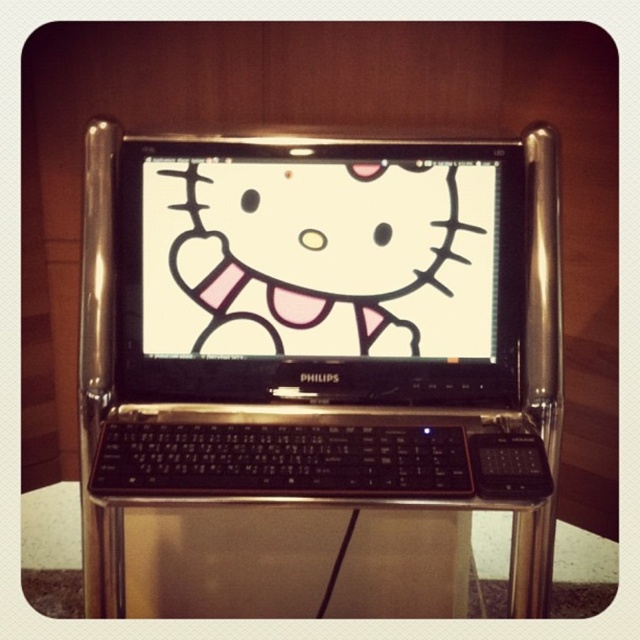
Does point (429, 275) come closer to viewer compared to point (326, 209)?

No, it is behind (326, 209).

Is point (472, 269) more distant than point (276, 227)?

No, (472, 269) is in front of (276, 227).

Image resolution: width=640 pixels, height=640 pixels. What are the coordinates of `white matte hello kitty at center` in the screenshot? It's located at (317, 259).

The width and height of the screenshot is (640, 640). Identify the location of white matte hello kitty at center. (317, 259).

Between black plastic laptop at center and matte white face at center, which one appears on the right side from the viewer's perspective?

From the viewer's perspective, black plastic laptop at center appears more on the right side.

Between black plastic laptop at center and matte white face at center, which one has less height?

Standing shorter between the two is matte white face at center.

Which is behind, point (198, 484) or point (280, 244)?

The point (280, 244) is more distant.

Find the location of a particular element. This screenshot has height=640, width=640. black plastic laptop at center is located at coordinates (321, 320).

Is point (420, 252) less distant than point (362, 294)?

Yes, it is in front of point (362, 294).

Is black plastic laptop at center smaller than white matte hello kitty at center?

No, black plastic laptop at center is not smaller than white matte hello kitty at center.

Looking at this image, who is more forward, [157,436] or [284,209]?

Point [157,436] is more forward.

At what (x,y) coordinates should I click in order to perform the action: click on black plastic laptop at center. Please return your answer as a coordinate pair (x, y). The height and width of the screenshot is (640, 640). Looking at the image, I should click on (321, 320).